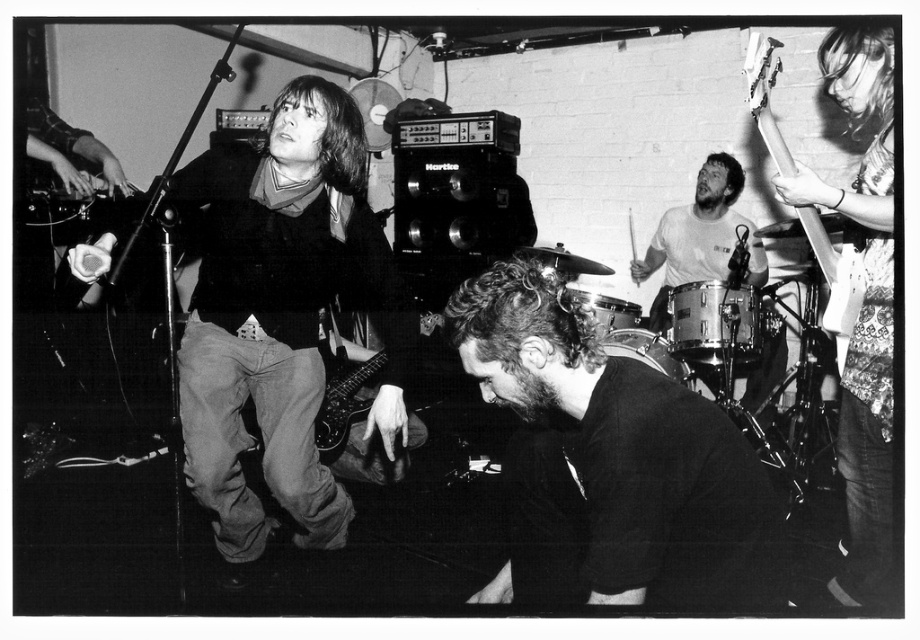
Based on the scene description, can you identify the object located at the coordinates point (608, 460)?

The object at point (608, 460) is the black matte shirt at center.

You are standing in the audience of this live music performance. There are two points marked on the stage. One is at coordinate point(828, 42) and the other is at point(821, 259). Which point is closer to you?

Point(828, 42) is closer to the viewer than point(821, 259).